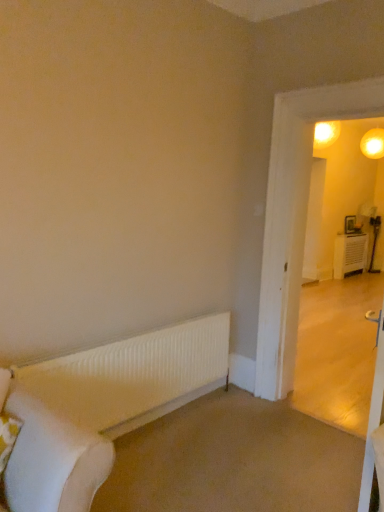
The height and width of the screenshot is (512, 384). I want to click on free space below white ribbed radiator at lower left (from a real-world perspective), so click(173, 417).